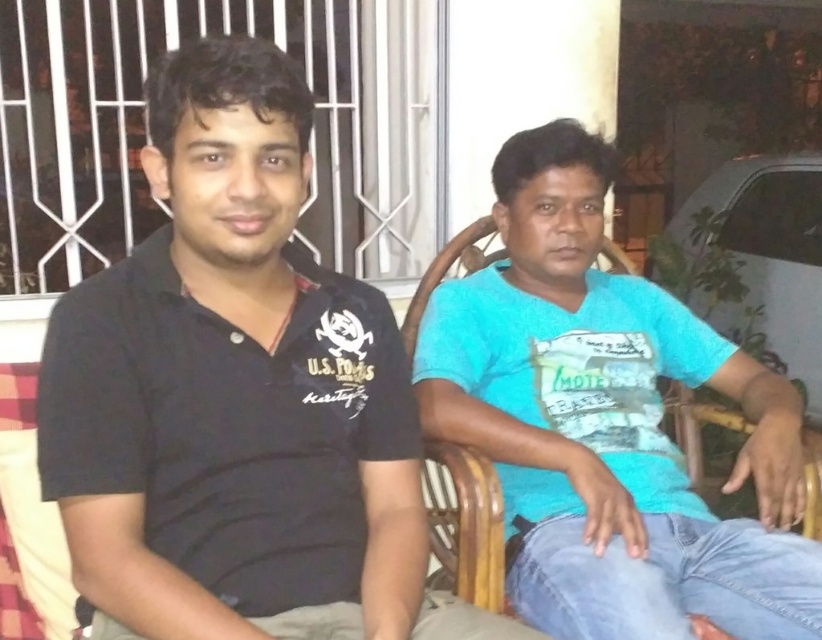
Who is more distant from viewer, [391,456] or [596,440]?

Point [596,440]

Which of these two, black cotton shirt at left or blue cotton shirt at center, stands taller?

blue cotton shirt at center is taller.

Who is more forward, (222, 417) or (624, 348)?

Point (222, 417)

Find the location of a particular element. This screenshot has height=640, width=822. black cotton shirt at left is located at coordinates (238, 396).